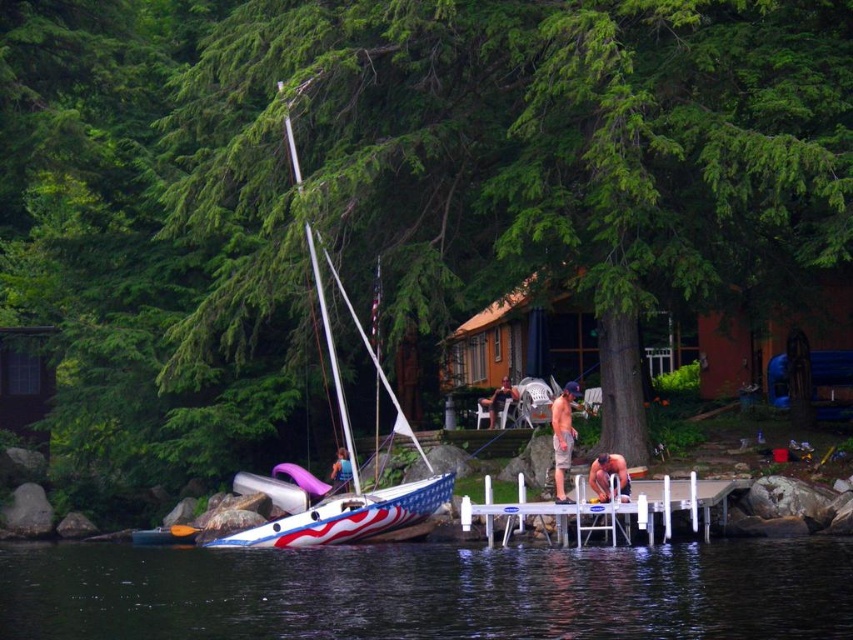
Question: Which point is farther to the camera?

Choices:
 (A) matte white sailboat at center
 (B) smooth tan skin at lower right
 (C) american flag painted wood sailboat at left
 (D) white plastic dock at center

Answer: (A)

Question: Is american flag painted sailboat at center above tan shorts at center?

Choices:
 (A) yes
 (B) no

Answer: (B)

Question: Which of the following is the farthest from the observer?

Choices:
 (A) (55, 632)
 (B) (624, 481)
 (C) (502, 404)
 (D) (339, 461)

Answer: (C)

Question: Does transparent water at lower center have a smaller size compared to tan shorts at center?

Choices:
 (A) yes
 (B) no

Answer: (B)

Question: Based on their relative distances, which object is farther from the white plastic dock at center?

Choices:
 (A) american flag painted wood sailboat at left
 (B) american flag painted sailboat at center

Answer: (A)

Question: Does white plastic dock at center appear under american flag painted sailboat at center?

Choices:
 (A) no
 (B) yes

Answer: (A)